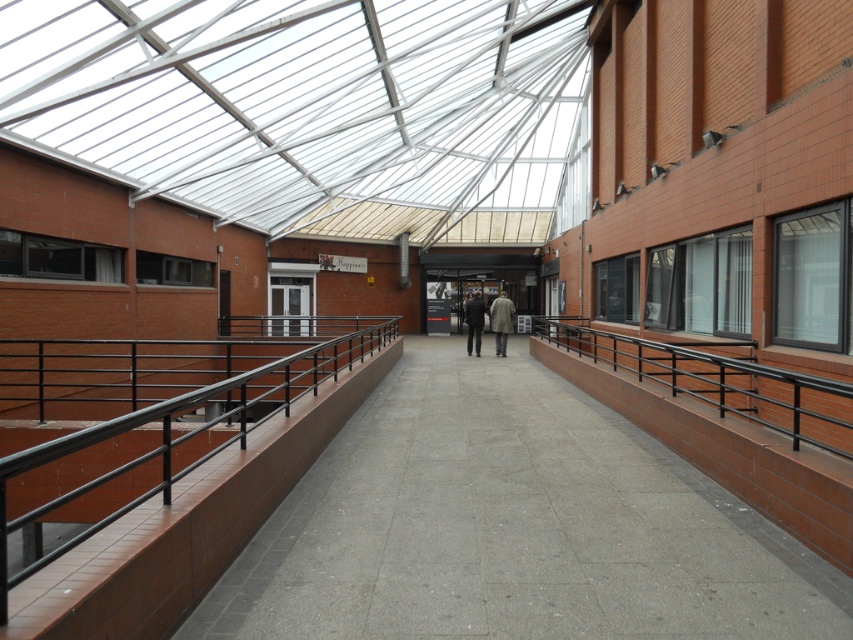
Question: Is concrete at center behind black metal/rail at center?

Choices:
 (A) no
 (B) yes

Answer: (B)

Question: Which of these objects is positioned closest to the dark gray suit at center?

Choices:
 (A) black metal/rail at center
 (B) light brown textured coat at center
 (C) black metal/rail at right
 (D) concrete at center

Answer: (B)

Question: Which of these objects is positioned farthest from the dark gray suit at center?

Choices:
 (A) light brown textured coat at center
 (B) black metal/rail at center
 (C) concrete at center

Answer: (C)

Question: Is black metal/rail at center thinner than light brown textured coat at center?

Choices:
 (A) no
 (B) yes

Answer: (A)

Question: Is black metal/rail at center above light brown textured coat at center?

Choices:
 (A) no
 (B) yes

Answer: (A)

Question: Which of the following is the closest to the observer?

Choices:
 (A) (476, 305)
 (B) (505, 524)
 (C) (503, 298)
 (D) (1, 552)

Answer: (D)